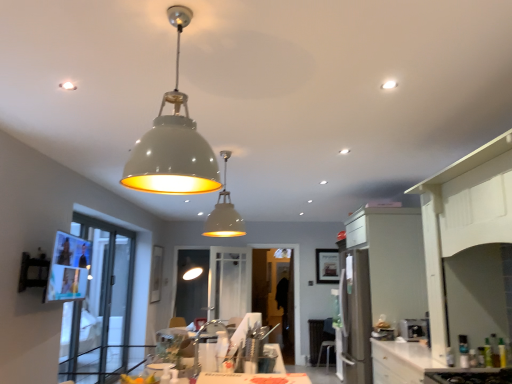
Question: Would you consider transparent glass door at left, arranged as the 2th glass door when viewed from the right, to be distant from white glossy countertop at lower right?

Choices:
 (A) yes
 (B) no

Answer: (A)

Question: Is the surface of transparent glass door at left, arranged as the 2th glass door when viewed from the right, in direct contact with white glossy countertop at lower right?

Choices:
 (A) no
 (B) yes

Answer: (A)

Question: Can you confirm if transparent glass door at left, which appears as the 1th glass door when viewed from the left, is positioned to the left of white glossy countertop at lower right?

Choices:
 (A) no
 (B) yes

Answer: (B)

Question: Can we say transparent glass door at left, which is counted as the 1th glass door, starting from the front, lies outside white glossy countertop at lower right?

Choices:
 (A) no
 (B) yes

Answer: (B)

Question: Does transparent glass door at left, arranged as the 2th glass door when viewed from the right, have a lesser height compared to white glossy countertop at lower right?

Choices:
 (A) yes
 (B) no

Answer: (B)

Question: Looking at the image, does matte white dome at center, which is the 1th lamp from front to back, seem bigger or smaller compared to transparent glass door at left, which is counted as the 1th glass door, starting from the front?

Choices:
 (A) big
 (B) small

Answer: (B)

Question: Considering the positions of matte white dome at center, which is the 1th lamp from front to back, and transparent glass door at left, which is the second glass door from back to front, in the image, is matte white dome at center, which is the 1th lamp from front to back, wider or thinner than transparent glass door at left, which is the second glass door from back to front,?

Choices:
 (A) thin
 (B) wide

Answer: (B)

Question: Is point (177, 18) positioned closer to the camera than point (94, 349)?

Choices:
 (A) farther
 (B) closer

Answer: (B)

Question: Considering the relative positions of matte white dome at center, which is the 1th lamp from front to back, and transparent glass door at left, which is the second glass door from back to front, in the image provided, is matte white dome at center, which is the 1th lamp from front to back, to the left or to the right of transparent glass door at left, which is the second glass door from back to front,?

Choices:
 (A) right
 (B) left

Answer: (A)

Question: Based on their positions, is matte white dome at center, the second lamp when ordered from back to front, located to the left or right of matte white pendant light at center, which ranks as the 1th lamp in back-to-front order?

Choices:
 (A) left
 (B) right

Answer: (A)

Question: Looking at their shapes, would you say matte white dome at center, which is the 1th lamp from front to back, is wider or thinner than matte white pendant light at center, which ranks as the 1th lamp in back-to-front order?

Choices:
 (A) wide
 (B) thin

Answer: (A)

Question: Is matte white dome at center, which is the 1th lamp from front to back, in front of or behind matte white pendant light at center, which ranks as the 1th lamp in back-to-front order, in the image?

Choices:
 (A) behind
 (B) front

Answer: (B)

Question: From the image's perspective, is matte white dome at center, the second lamp when ordered from back to front, positioned above or below matte white pendant light at center, which ranks as the 1th lamp in back-to-front order?

Choices:
 (A) above
 (B) below

Answer: (A)

Question: From the image's perspective, relative to matte white chair at lower center, is satin white cabinet at right above or below?

Choices:
 (A) above
 (B) below

Answer: (A)

Question: Considering their positions, is satin white cabinet at right located in front of or behind matte white chair at lower center?

Choices:
 (A) behind
 (B) front

Answer: (B)